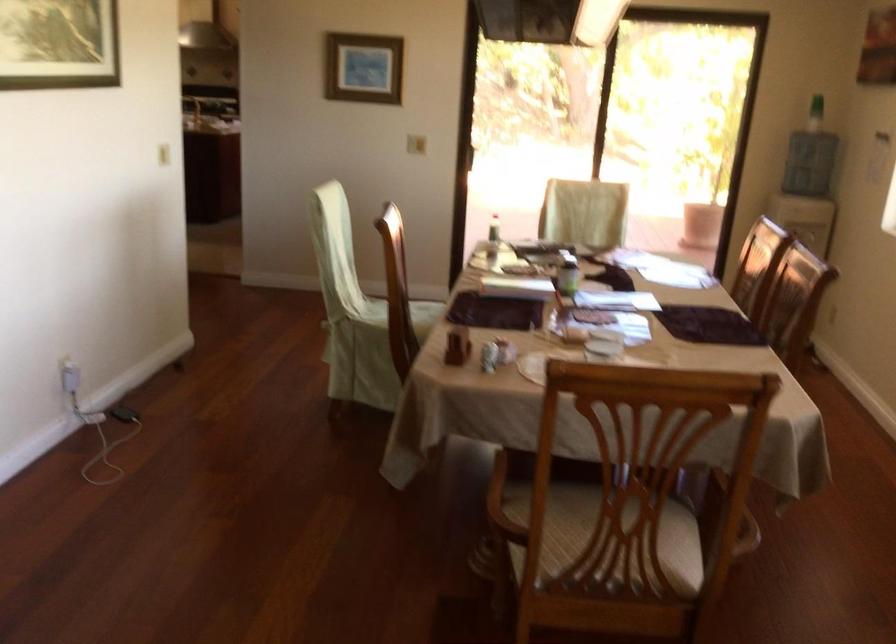
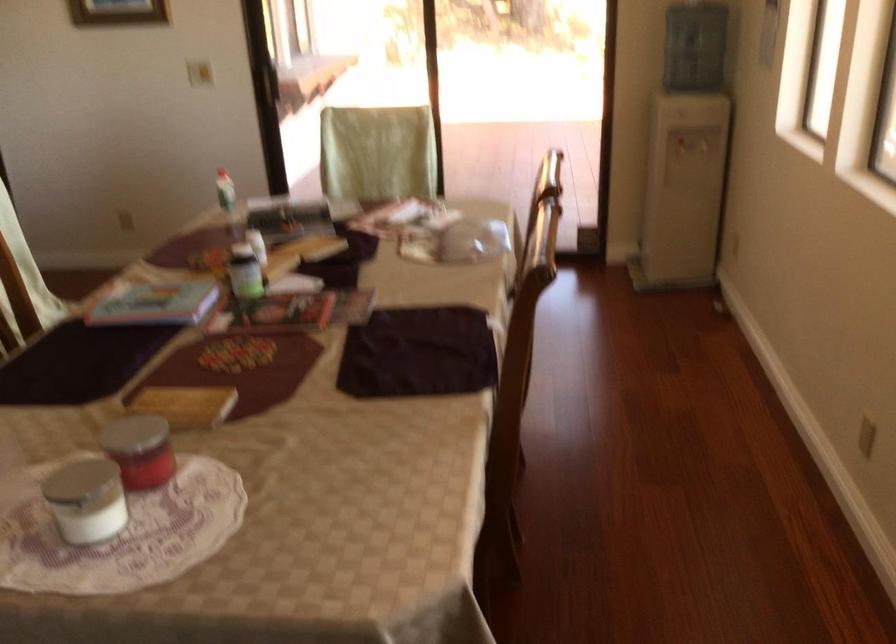
Locate, in the second image, the point that corresponds to [607,355] in the first image.

(85, 500)